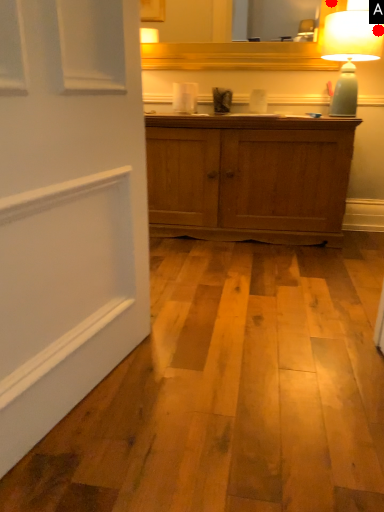
Question: Two points are circled on the image, labeled by A and B beside each circle. Which of the following is the closest to the observer?

Choices:
 (A) A is closer
 (B) B is closer

Answer: (A)